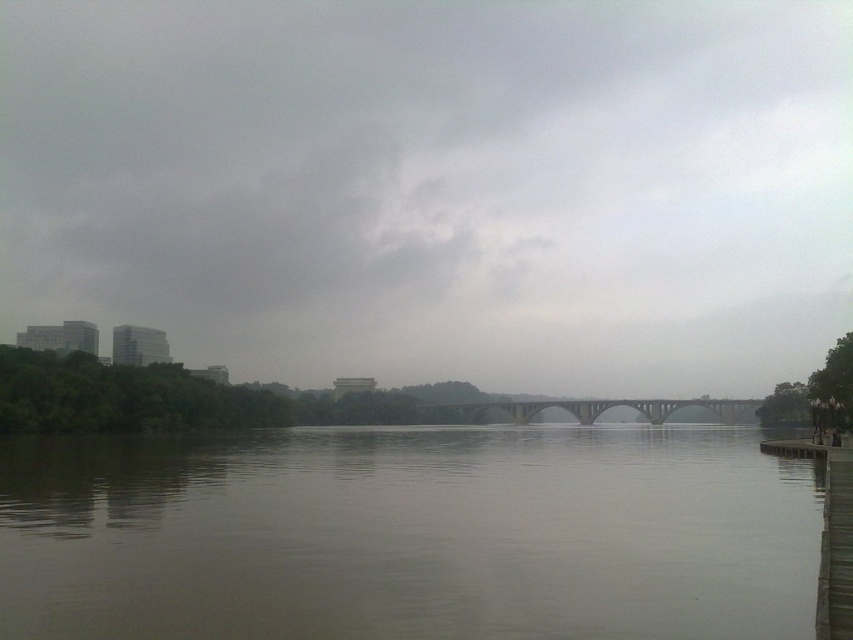
Consider the image. Based on the scene described, where is the point located at coordinates (436, 186)?

The point at coordinates (436, 186) corresponds to the gray cloudy sky at upper center.

You are standing on the riverside path and want to take a photo of the brown wooden dock at lower right and the concrete bridge at center. Which one should you focus on first if you want to capture both in a single frame without moving your camera?

The brown wooden dock at lower right is positioned over the concrete bridge at center, so you should focus on the brown wooden dock at lower right first to ensure both are in focus.

You are a drone operator planning to fly a drone between the gray cloudy sky at upper center and the concrete bridge at center. The drone has a maximum flight distance of 150 meters. Based on the scene, can the drone safely fly between these two points without exceeding its range?

The gray cloudy sky at upper center and concrete bridge at center are 141.09 meters apart from each other. Since the drone has a maximum flight distance of 150 meters, it can safely fly between these two points as the distance is within its range.